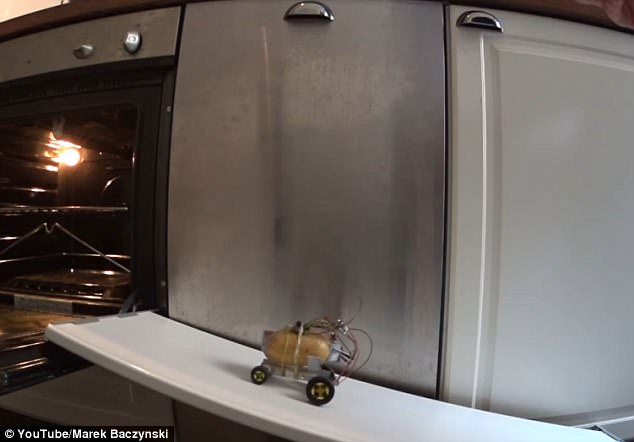
Where is `oven rack`? oven rack is located at coordinates (89, 207).